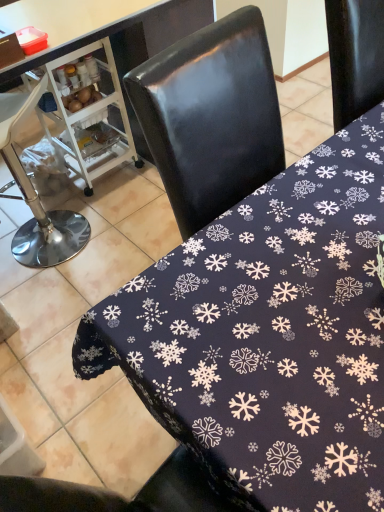
What do you see at coordinates (87, 113) in the screenshot?
I see `white plastic cart at left` at bounding box center [87, 113].

Where is `dark blue fabric with snowflake pattern at center, the 1th table positioned from the right`? Image resolution: width=384 pixels, height=512 pixels. dark blue fabric with snowflake pattern at center, the 1th table positioned from the right is located at coordinates (268, 335).

The height and width of the screenshot is (512, 384). What are the coordinates of `table above the brushed metal bar stool at left (from the image's perspective)` in the screenshot? It's located at (146, 44).

From the image's perspective, is black fabric tablecloth at center, the second table in the right-to-left sequence, above brushed metal bar stool at left?

Indeed, from the image's perspective, black fabric tablecloth at center, the second table in the right-to-left sequence, is shown above brushed metal bar stool at left.

Between black fabric tablecloth at center, the first table positioned from the left, and brushed metal bar stool at left, which one has larger size?

With larger size is black fabric tablecloth at center, the first table positioned from the left.

Who is bigger, dark blue fabric with snowflake pattern at center, which is the 2th table from left to right, or white plastic cart at left?

With larger size is dark blue fabric with snowflake pattern at center, which is the 2th table from left to right.

Starting from the white plastic cart at left, which table is the 2nd one in front? Please provide its 2D coordinates.

[(268, 335)]

From a real-world perspective, is dark blue fabric with snowflake pattern at center, which is the 2th table from left to right, above or below white plastic cart at left?

dark blue fabric with snowflake pattern at center, which is the 2th table from left to right, is above white plastic cart at left.

Is white plastic cart at left at the back of dark blue fabric with snowflake pattern at center, which is the 2th table from left to right?

No, dark blue fabric with snowflake pattern at center, which is the 2th table from left to right, is not facing away from white plastic cart at left.

How different are the orientations of white plastic cart at left and dark blue fabric with snowflake pattern at center, the 1th table positioned from the right, in degrees?

The angle between the facing direction of white plastic cart at left and the facing direction of dark blue fabric with snowflake pattern at center, the 1th table positioned from the right, is 94.8 degrees.

Is white plastic cart at left facing towards dark blue fabric with snowflake pattern at center, which is the 2th table from left to right?

No, white plastic cart at left is not facing towards dark blue fabric with snowflake pattern at center, which is the 2th table from left to right.

Relative to dark blue fabric with snowflake pattern at center, which is the 2th table from left to right, is white plastic cart at left in front or behind?

white plastic cart at left is positioned farther from the viewer than dark blue fabric with snowflake pattern at center, which is the 2th table from left to right.

Considering the sizes of white plastic cart at left and dark blue fabric with snowflake pattern at center, the 1th table positioned from the right, in the image, is white plastic cart at left bigger or smaller than dark blue fabric with snowflake pattern at center, the 1th table positioned from the right,?

Clearly, white plastic cart at left is smaller in size than dark blue fabric with snowflake pattern at center, the 1th table positioned from the right.

Do you think white plastic cart at left is within black fabric tablecloth at center, the second table in the right-to-left sequence, or outside of it?

The correct answer is: inside.

Is white plastic cart at left aimed at black fabric tablecloth at center, the first table positioned from the left?

Yes, white plastic cart at left is aimed at black fabric tablecloth at center, the first table positioned from the left.

Is white plastic cart at left closer to camera compared to black fabric tablecloth at center, the second table in the right-to-left sequence?

That is False.

Could you tell me if dark blue fabric with snowflake pattern at center, which is the 2th table from left to right, is turned towards black fabric tablecloth at center, the first table positioned from the left?

No, dark blue fabric with snowflake pattern at center, which is the 2th table from left to right, is not turned towards black fabric tablecloth at center, the first table positioned from the left.

Between point (143, 336) and point (40, 58), which one is positioned in front?

The point (143, 336) is in front.

In the image, there is a black fabric tablecloth at center, the first table positioned from the left. Where is `table below it (from the image's perspective)`? The width and height of the screenshot is (384, 512). table below it (from the image's perspective) is located at coordinates (268, 335).

Is black fabric tablecloth at center, the second table in the right-to-left sequence, positioned with its back to white plastic cart at left?

Yes, white plastic cart at left is at the back of black fabric tablecloth at center, the second table in the right-to-left sequence.

Looking at their sizes, would you say black fabric tablecloth at center, the second table in the right-to-left sequence, is wider or thinner than white plastic cart at left?

Clearly, black fabric tablecloth at center, the second table in the right-to-left sequence, has more width compared to white plastic cart at left.

Is black fabric tablecloth at center, the second table in the right-to-left sequence, next to white plastic cart at left and touching it?

No, black fabric tablecloth at center, the second table in the right-to-left sequence, is not making contact with white plastic cart at left.

Is dark blue fabric with snowflake pattern at center, which is the 2th table from left to right, inside black fabric tablecloth at center, the first table positioned from the left?

No, dark blue fabric with snowflake pattern at center, which is the 2th table from left to right, is located outside of black fabric tablecloth at center, the first table positioned from the left.

Which object is positioned more to the left, black fabric tablecloth at center, the second table in the right-to-left sequence, or dark blue fabric with snowflake pattern at center, the 1th table positioned from the right?

black fabric tablecloth at center, the second table in the right-to-left sequence.

Consider the image. From the image's perspective, would you say black fabric tablecloth at center, the second table in the right-to-left sequence, is positioned over dark blue fabric with snowflake pattern at center, the 1th table positioned from the right?

Correct, black fabric tablecloth at center, the second table in the right-to-left sequence, appears higher than dark blue fabric with snowflake pattern at center, the 1th table positioned from the right, in the image.

Looking at their sizes, would you say black fabric tablecloth at center, the second table in the right-to-left sequence, is wider or thinner than dark blue fabric with snowflake pattern at center, which is the 2th table from left to right?

black fabric tablecloth at center, the second table in the right-to-left sequence, is thinner than dark blue fabric with snowflake pattern at center, which is the 2th table from left to right.

At what (x,y) coordinates should I click in order to perform the action: click on chair below the black fabric tablecloth at center, the first table positioned from the left (from a real-world perspective). Please return your answer as a coordinate pair (x, y). The width and height of the screenshot is (384, 512). Looking at the image, I should click on (37, 197).

Image resolution: width=384 pixels, height=512 pixels. In order to click on table that is the 2nd object located in front of the white plastic cart at left in this screenshot , I will do `click(268, 335)`.

From the image, which object appears to be farther from black fabric tablecloth at center, the first table positioned from the left, brushed metal bar stool at left or white plastic cart at left?

brushed metal bar stool at left is positioned further to the anchor black fabric tablecloth at center, the first table positioned from the left.

From the image, which object appears to be nearer to dark blue fabric with snowflake pattern at center, which is the 2th table from left to right, brushed metal bar stool at left or black fabric tablecloth at center, the second table in the right-to-left sequence?

The object closer to dark blue fabric with snowflake pattern at center, which is the 2th table from left to right, is black fabric tablecloth at center, the second table in the right-to-left sequence.

From the image, which object appears to be nearer to white plastic cart at left, brushed metal bar stool at left or black fabric tablecloth at center, the second table in the right-to-left sequence?

Among the two, black fabric tablecloth at center, the second table in the right-to-left sequence, is located nearer to white plastic cart at left.

When comparing their distances from white plastic cart at left, does black fabric tablecloth at center, the second table in the right-to-left sequence, or brushed metal bar stool at left seem further?

brushed metal bar stool at left is further to white plastic cart at left.

Which object lies further to the anchor point white plastic cart at left, dark blue fabric with snowflake pattern at center, the 1th table positioned from the right, or black fabric tablecloth at center, the first table positioned from the left?

dark blue fabric with snowflake pattern at center, the 1th table positioned from the right.

When comparing their distances from white plastic cart at left, does black fabric tablecloth at center, the first table positioned from the left, or dark blue fabric with snowflake pattern at center, the 1th table positioned from the right, seem further?

dark blue fabric with snowflake pattern at center, the 1th table positioned from the right, is positioned further to the anchor white plastic cart at left.

When comparing their distances from brushed metal bar stool at left, does white plastic cart at left or black fabric tablecloth at center, the first table positioned from the left, seem further?

Based on the image, black fabric tablecloth at center, the first table positioned from the left, appears to be further to brushed metal bar stool at left.

From the image, which object appears to be nearer to brushed metal bar stool at left, dark blue fabric with snowflake pattern at center, which is the 2th table from left to right, or white plastic cart at left?

The object closer to brushed metal bar stool at left is white plastic cart at left.

Locate an element on the screen. The height and width of the screenshot is (512, 384). table located between brushed metal bar stool at left and dark blue fabric with snowflake pattern at center, the 1th table positioned from the right, in the left-right direction is located at coordinates (146, 44).

The image size is (384, 512). Find the location of `table between white plastic cart at left and brushed metal bar stool at left in the vertical direction`. table between white plastic cart at left and brushed metal bar stool at left in the vertical direction is located at coordinates (146, 44).

The height and width of the screenshot is (512, 384). Identify the location of appliance between brushed metal bar stool at left and dark blue fabric with snowflake pattern at center, which is the 2th table from left to right, in the horizontal direction. tap(87, 113).

Locate an element on the screen. The image size is (384, 512). table between white plastic cart at left and dark blue fabric with snowflake pattern at center, the 1th table positioned from the right, in the horizontal direction is located at coordinates (146, 44).